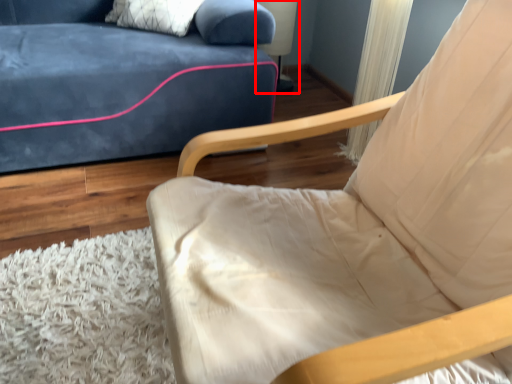
Question: In this image, where is table lamp (annotated by the red box) located relative to chair?

Choices:
 (A) left
 (B) right

Answer: (A)